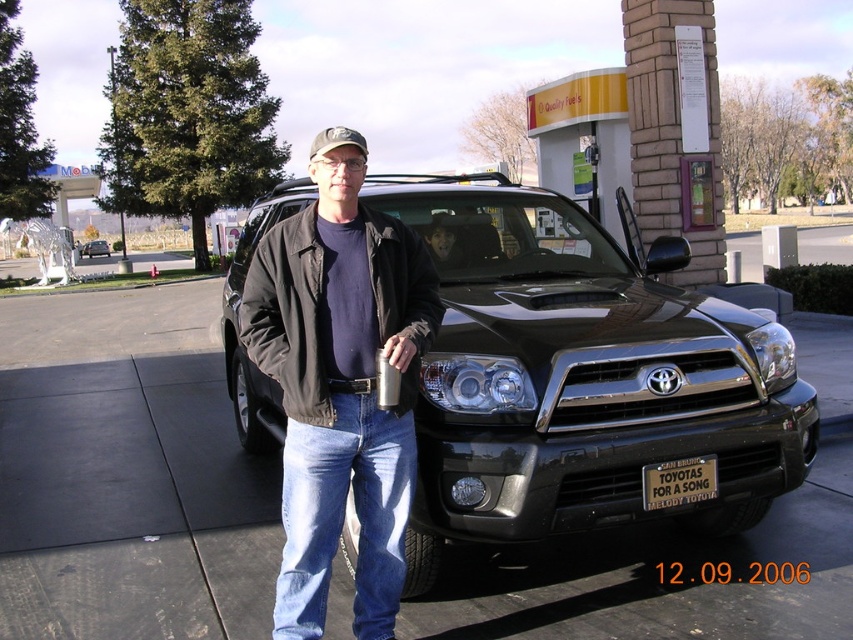
Question: Does metallic silver license plate at front center appear on the right side of camouflage fabric baseball cap at upper center?

Choices:
 (A) no
 (B) yes

Answer: (B)

Question: Which point is closer to the camera taking this photo?

Choices:
 (A) (390, 284)
 (B) (312, 147)

Answer: (B)

Question: Which object is positioned closest to the black metallic suv at center?

Choices:
 (A) metallic silver license plate at front center
 (B) matte black face at center
 (C) camouflage fabric baseball cap at upper center

Answer: (B)

Question: Which point appears closest to the camera in this image?

Choices:
 (A) (96, 243)
 (B) (440, 266)
 (C) (315, 154)
 (D) (583, 499)

Answer: (C)

Question: Is black metallic suv at center to the left of black matte suv at center from the viewer's perspective?

Choices:
 (A) no
 (B) yes

Answer: (A)

Question: Does black leather jacket at center lie behind black matte suv at center?

Choices:
 (A) yes
 (B) no

Answer: (B)